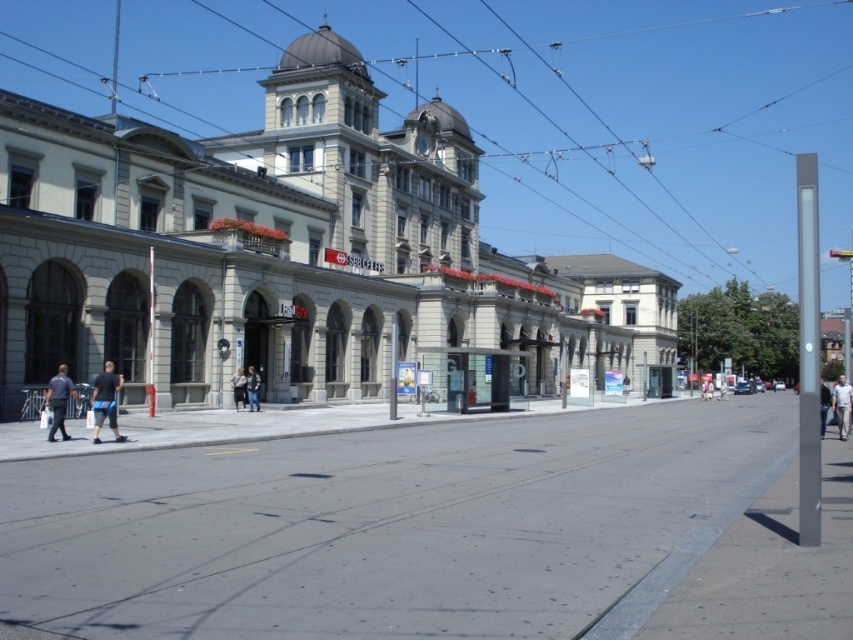
Can you confirm if gray concrete pavement at lower center is positioned to the right of light gray shirt at right?

Incorrect, gray concrete pavement at lower center is not on the right side of light gray shirt at right.

Can you confirm if gray concrete pavement at lower center is wider than light gray shirt at right?

No.

Between point (741, 592) and point (838, 416), which one is positioned behind?

Positioned behind is point (838, 416).

You are a GUI agent. You are given a task and a screenshot of the screen. Output one action in this format:
    pyautogui.click(x=<x>, y=<y>)
    Task: Click on the gray concrete pavement at lower center
    
    Given the screenshot: What is the action you would take?
    pyautogui.click(x=439, y=532)

Can you confirm if gray concrete pavement at lower center is smaller than dark blue jeans at left?

Actually, gray concrete pavement at lower center might be larger than dark blue jeans at left.

Describe the element at coordinates (439, 532) in the screenshot. I see `gray concrete pavement at lower center` at that location.

Does point (560, 509) come behind point (57, 371)?

No.

You are a GUI agent. You are given a task and a screenshot of the screen. Output one action in this format:
    pyautogui.click(x=<x>, y=<y>)
    Task: Click on the gray concrete pavement at lower center
    This screenshot has width=853, height=640.
    Given the screenshot: What is the action you would take?
    pyautogui.click(x=439, y=532)

Does light brown leather jacket at center appear on the left side of light blue jeans at center?

Yes, light brown leather jacket at center is to the left of light blue jeans at center.

Between point (242, 401) and point (708, 392), which one is positioned behind?

Positioned behind is point (708, 392).

Find the location of a particular element. Image resolution: width=853 pixels, height=640 pixels. light brown leather jacket at center is located at coordinates (239, 388).